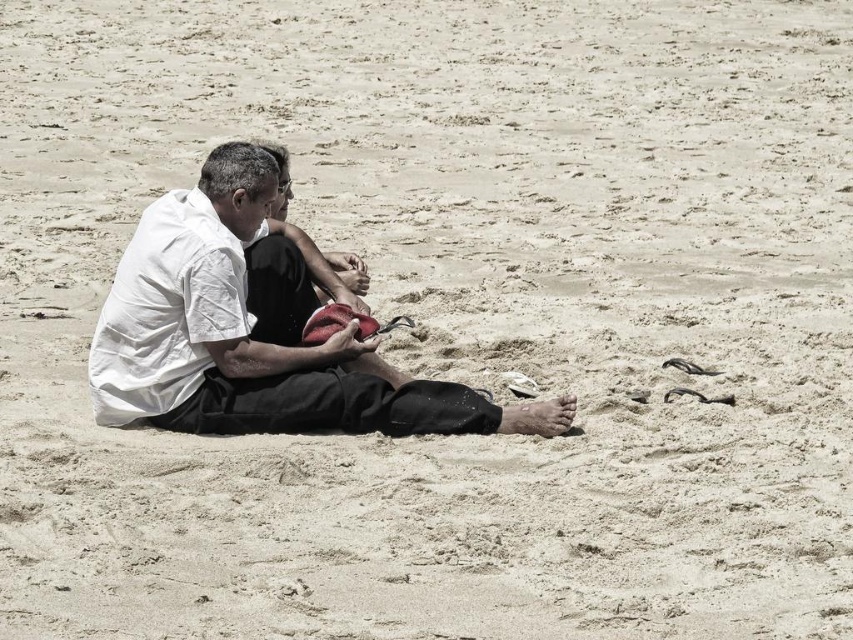
You are a fashion designer observing two shirts displayed on mannequins in a store window. The shirts are the white cotton shirt at center and the black cotton shirt at center. Which shirt has a bigger size?

The white cotton shirt at center has a larger size compared to the black cotton shirt at center, so the white cotton shirt at center is bigger.

You are a photographer trying to capture a closeup of the white cotton shirt at center. Based on the scene description, where should you position your camera to ensure the shirt is centered in the frame?

The white cotton shirt at center is located at the 2D coordinates point (x=257, y=330), so you should position your camera directly facing that point to center it in the frame.